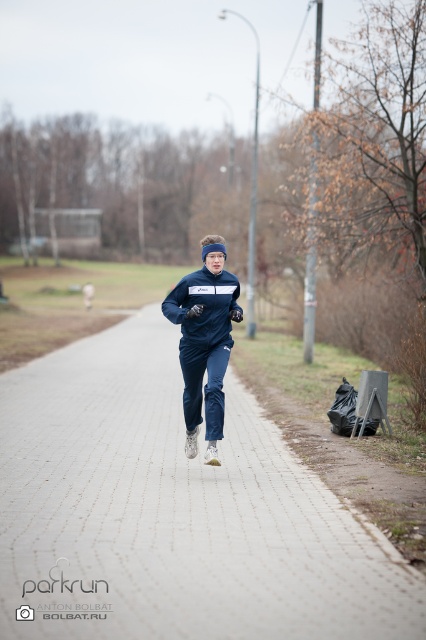
You are a delivery robot that needs to place a package on the gray brick pavement at center. However, there is a navy blue fleece sweatshirt at center in the way. Can you move the sweatshirt to the side to access the pavement?

The gray brick pavement at center is located below the navy blue fleece sweatshirt at center, so you can move the navy blue fleece sweatshirt at center to the side to access the gray brick pavement at center.

You are a photographer standing on the path and want to take a photo of the person jogging. You notice both the navy blue tracksuit at center and the navy blue fleece sweatshirt at center. Which clothing item will appear larger in your photo?

The navy blue tracksuit at center will appear larger in the photo because it is closer to the viewer than the navy blue fleece sweatshirt at center.